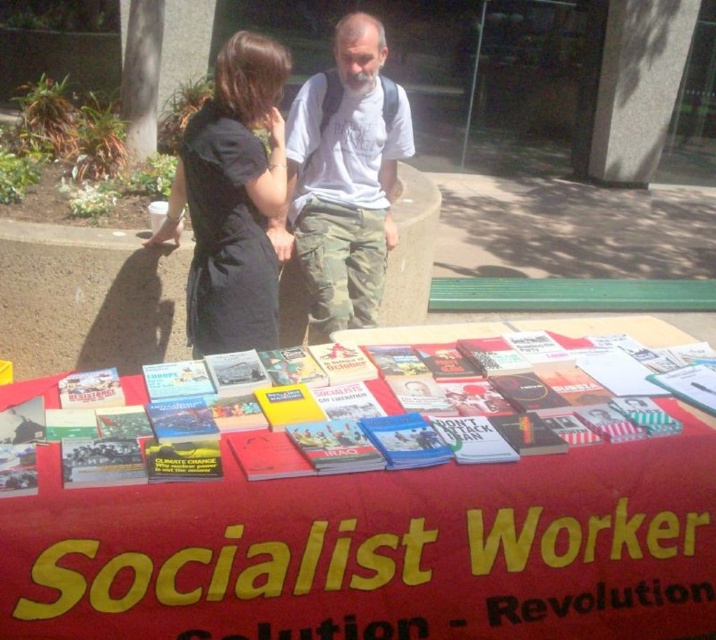
Can you confirm if red paper table at center is thinner than white cotton t-shirt at center?

Incorrect, red paper table at center's width is not less than white cotton t-shirt at center's.

Can you confirm if red paper table at center is taller than white cotton t-shirt at center?

In fact, red paper table at center may be shorter than white cotton t-shirt at center.

The height and width of the screenshot is (640, 716). Describe the element at coordinates (374, 497) in the screenshot. I see `red paper table at center` at that location.

This screenshot has height=640, width=716. Identify the location of red paper table at center. (374, 497).

Who is more distant from viewer, (x=352, y=273) or (x=266, y=316)?

The point (x=352, y=273) is behind.

Is point (301, 218) less distant than point (263, 240)?

That is False.

The height and width of the screenshot is (640, 716). In order to click on white cotton t-shirt at center in this screenshot , I will do `click(343, 179)`.

What do you see at coordinates (374, 497) in the screenshot?
I see `red paper table at center` at bounding box center [374, 497].

Which is in front, point (527, 570) or point (200, 260)?

Point (527, 570)

The height and width of the screenshot is (640, 716). I want to click on red paper table at center, so click(374, 497).

Find the location of a particular element. red paper table at center is located at coordinates (374, 497).